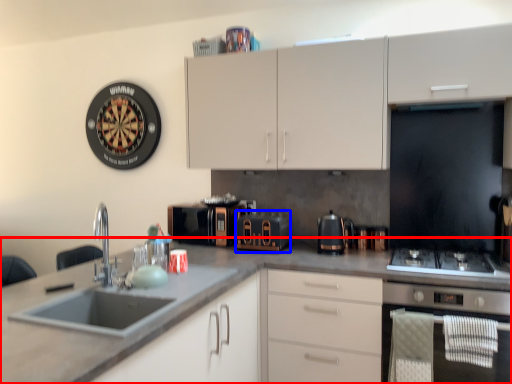
Question: Which object is closer to the camera taking this photo, countertop (highlighted by a red box) or appliance (highlighted by a blue box)?

Choices:
 (A) countertop
 (B) appliance

Answer: (A)